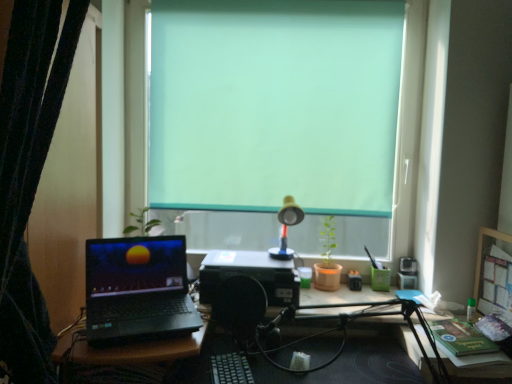
What do you see at coordinates (408, 131) in the screenshot? The image size is (512, 384). I see `teal matte window at center` at bounding box center [408, 131].

Locate an element on the screen. The width and height of the screenshot is (512, 384). teal matte window at center is located at coordinates (408, 131).

You are a GUI agent. You are given a task and a screenshot of the screen. Output one action in this format:
    pyautogui.click(x=<x>, y=<y>)
    Task: Click on the black fabric curtain at left
    The height and width of the screenshot is (384, 512).
    Given the screenshot: What is the action you would take?
    tap(29, 174)

The image size is (512, 384). Describe the element at coordinates (29, 174) in the screenshot. I see `black fabric curtain at left` at that location.

At what (x,y) coordinates should I click in order to perform the action: click on teal matte window at center. Please return your answer as a coordinate pair (x, y). The width and height of the screenshot is (512, 384). Looking at the image, I should click on (408, 131).

Is teal matte window at center to the left or to the right of black fabric curtain at left in the image?

In the image, teal matte window at center appears on the right side of black fabric curtain at left.

Is the depth of teal matte window at center greater than that of black fabric curtain at left?

That is True.

Is point (136, 188) closer or farther from the camera than point (20, 356)?

Point (136, 188) is positioned farther from the camera compared to point (20, 356).

From the image's perspective, is teal matte window at center positioned above or below black fabric curtain at left?

Based on their image positions, teal matte window at center is located above black fabric curtain at left.

From a real-world perspective, is teal matte window at center positioned over black fabric curtain at left based on gravity?

Yes.

Looking at their sizes, would you say teal matte window at center is wider or thinner than black fabric curtain at left?

teal matte window at center is thinner than black fabric curtain at left.

Considering the relative sizes of teal matte window at center and black fabric curtain at left in the image provided, is teal matte window at center taller than black fabric curtain at left?

No.

Looking at the image, does teal matte window at center seem bigger or smaller compared to black fabric curtain at left?

In the image, teal matte window at center appears to be smaller than black fabric curtain at left.

Could black fabric curtain at left be considered to be inside teal matte window at center?

No, teal matte window at center does not contain black fabric curtain at left.

Is there a large distance between teal matte window at center and black fabric curtain at left?

That's right, there is a large distance between teal matte window at center and black fabric curtain at left.

Is teal matte window at center aimed at black fabric curtain at left?

No, teal matte window at center does not turn towards black fabric curtain at left.

Identify the location of curtain located underneath the teal matte window at center (from a real-world perspective). The height and width of the screenshot is (384, 512). (29, 174).

Between black fabric curtain at left and teal matte window at center, which one appears on the left side from the viewer's perspective?

black fabric curtain at left.

Is the position of black fabric curtain at left less distant than that of teal matte window at center?

Yes, black fabric curtain at left is closer to the viewer.

Is point (25, 375) positioned after point (133, 35)?

No.

Based on the photo, from the image's perspective, is black fabric curtain at left located above teal matte window at center?

No, from the image's perspective, black fabric curtain at left is not on top of teal matte window at center.

Looking at this image, from a real-world perspective, which is physically below, black fabric curtain at left or teal matte window at center?

black fabric curtain at left, from a real-world perspective.

In terms of width, does black fabric curtain at left look wider or thinner when compared to teal matte window at center?

Clearly, black fabric curtain at left has more width compared to teal matte window at center.

In terms of height, does black fabric curtain at left look taller or shorter compared to teal matte window at center?

black fabric curtain at left is taller than teal matte window at center.

In terms of size, does black fabric curtain at left appear bigger or smaller than teal matte window at center?

Clearly, black fabric curtain at left is larger in size than teal matte window at center.

Would you say black fabric curtain at left is inside or outside teal matte window at center?

black fabric curtain at left is located beyond the bounds of teal matte window at center.

Is black fabric curtain at left positioned far away from teal matte window at center?

Yes, black fabric curtain at left is far from teal matte window at center.

Is black fabric curtain at left oriented towards teal matte window at center?

No, black fabric curtain at left is not aimed at teal matte window at center.

How many degrees apart are the facing directions of black fabric curtain at left and teal matte window at center?

The angle between the facing direction of black fabric curtain at left and the facing direction of teal matte window at center is 0.424 degrees.

Identify the location of window on the right side of black fabric curtain at left. The height and width of the screenshot is (384, 512). (408, 131).

Identify the location of window above the black fabric curtain at left (from a real-world perspective). The width and height of the screenshot is (512, 384). (408, 131).

The height and width of the screenshot is (384, 512). In order to click on window behind the black fabric curtain at left in this screenshot , I will do `click(408, 131)`.